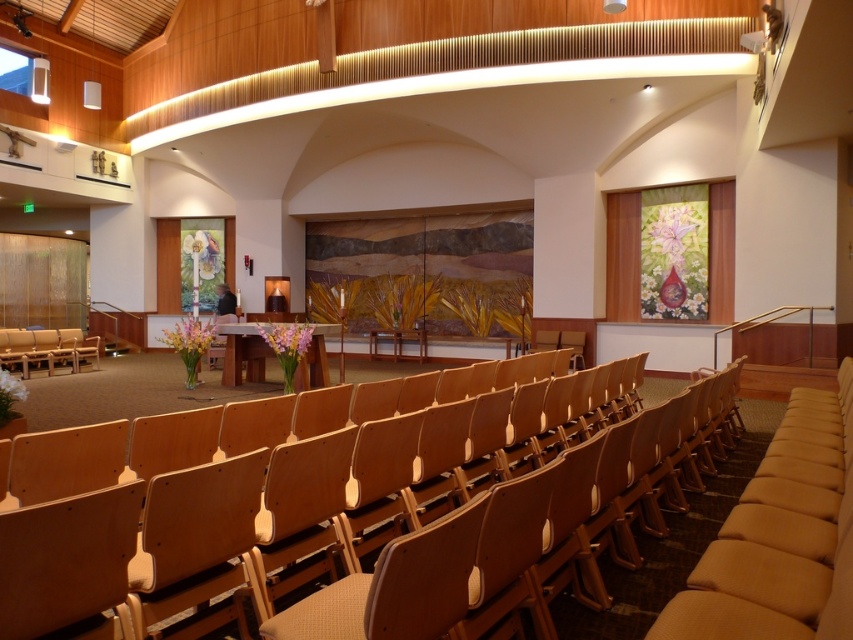
Question: Does light brown wood chair at center have a smaller size compared to light brown wood chair at left?

Choices:
 (A) no
 (B) yes

Answer: (A)

Question: Does light brown wood chair at center have a smaller size compared to light brown wood chair at left?

Choices:
 (A) no
 (B) yes

Answer: (A)

Question: Which object appears farthest from the camera in this image?

Choices:
 (A) light brown wood chair at left
 (B) light brown wood chair at center

Answer: (A)

Question: Which of the following is the farthest from the observer?

Choices:
 (A) light brown wood chair at left
 (B) light brown wood chair at center

Answer: (A)

Question: Does light brown wood chair at center appear on the left side of light brown wood chair at left?

Choices:
 (A) yes
 (B) no

Answer: (B)

Question: Which of the following is the farthest from the observer?

Choices:
 (A) pos(320,570)
 (B) pos(38,333)

Answer: (B)